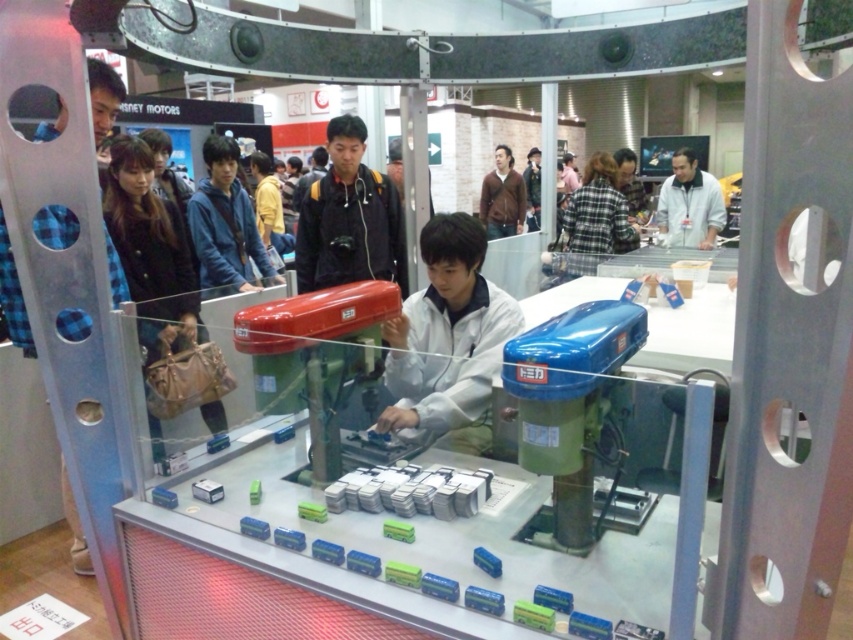
You are a security guard at the exhibition. You notice two items, a plaid fabric shirt at center and a brown leather jacket at upper center. Which item is positioned lower in the image?

The plaid fabric shirt at center is located below the brown leather jacket at upper center, so the plaid fabric shirt at center is positioned lower in the image.

Please look at the image and tell me what object is located at the coordinate point (595, 218). The scene is an indoor exhibition with robotic arms in a display case, and the objects include a plaid fabric shirt at center.

The object located at the coordinate point (595, 218) is the plaid fabric shirt at center.